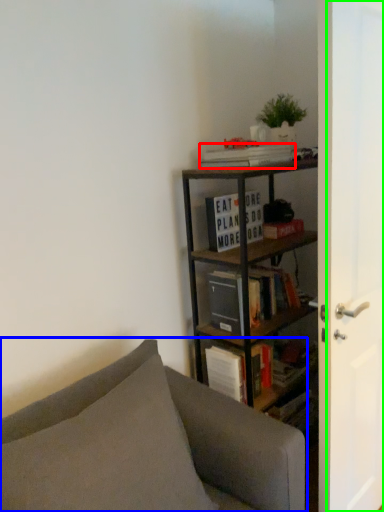
Question: Estimate the real-world distances between objects in this image. Which object is farther from book (highlighted by a red box), studio couch (highlighted by a blue box) or screen door (highlighted by a green box)?

Choices:
 (A) studio couch
 (B) screen door

Answer: (A)